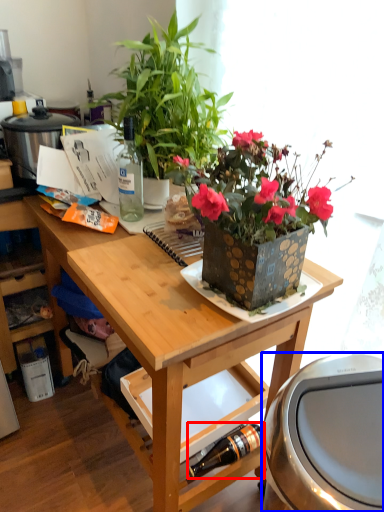
Question: Among these objects, which one is nearest to the camera, bottle (highlighted by a red box) or appliance (highlighted by a blue box)?

Choices:
 (A) bottle
 (B) appliance

Answer: (B)